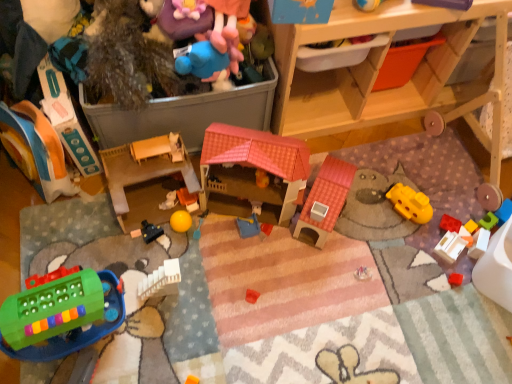
Identify the location of vacant space that is in between translucent orange cube at center, which ranks as the eleventh toy in left-to-right order, and yellow rubber ball at center, arranged as the 8th toy when viewed from the right. The height and width of the screenshot is (384, 512). (316, 240).